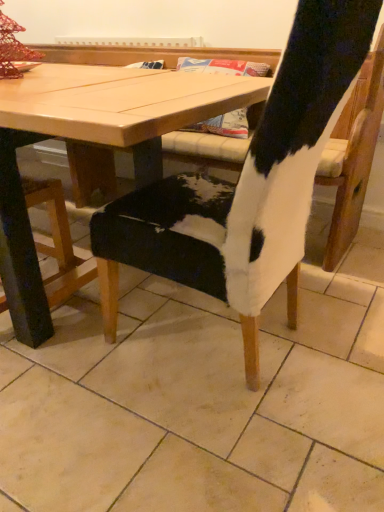
At what (x,y) coordinates should I click in order to perform the action: click on empty space that is ontop of cowhide chair at center (from a real-world perspective). Please return your answer as a coordinate pair (x, y). Looking at the image, I should click on (206, 356).